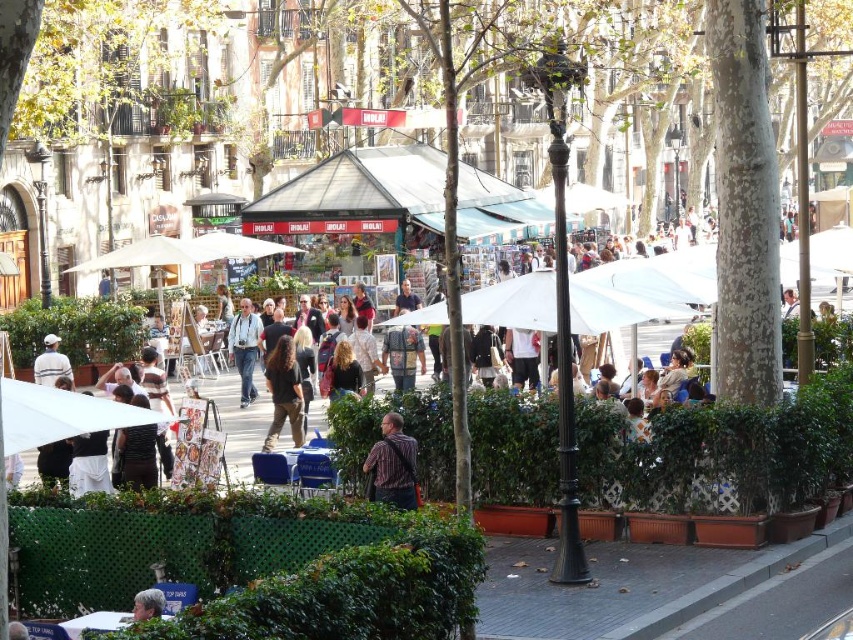
Question: Can you confirm if light brown leather jacket at center is thinner than light brown hair at center?

Choices:
 (A) yes
 (B) no

Answer: (B)

Question: Is white matte umbrella at center closer to the viewer compared to light brown leather jacket at center?

Choices:
 (A) no
 (B) yes

Answer: (B)

Question: Which of the following is the closest to the observer?

Choices:
 (A) (16, 424)
 (B) (589, 291)

Answer: (A)

Question: Does dark brown hair at center have a lesser width compared to light brown hair at center?

Choices:
 (A) yes
 (B) no

Answer: (A)

Question: Among these objects, which one is nearest to the camera?

Choices:
 (A) matte white cap at left
 (B) light brown hair at center
 (C) white matte umbrella at lower left
 (D) striped cotton shirt at center

Answer: (B)

Question: Which of these objects is positioned farthest from the white matte umbrella at center?

Choices:
 (A) dark brown hair at center
 (B) light brown leather jacket at center
 (C) striped cotton shirt at center

Answer: (B)